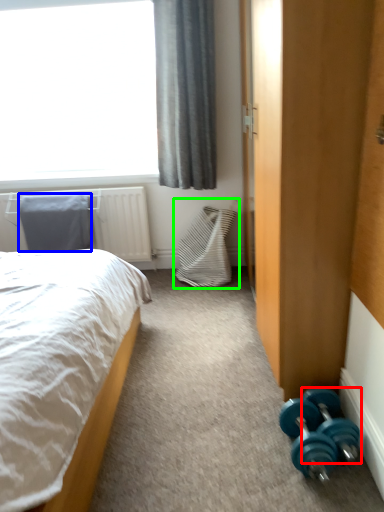
Question: Estimate the real-world distances between objects in this image. Which object is farther from dumbbell (highlighted by a red box), pillow (highlighted by a blue box) or swivel chair (highlighted by a green box)?

Choices:
 (A) pillow
 (B) swivel chair

Answer: (A)